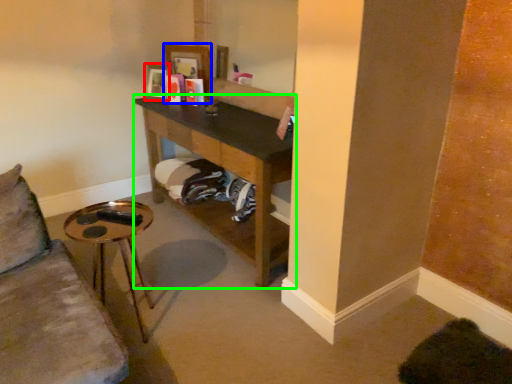
Question: Which object is positioned closest to picture frame (highlighted by a red box)? Select from picture frame (highlighted by a blue box) and shelf (highlighted by a green box).

Choices:
 (A) picture frame
 (B) shelf

Answer: (A)